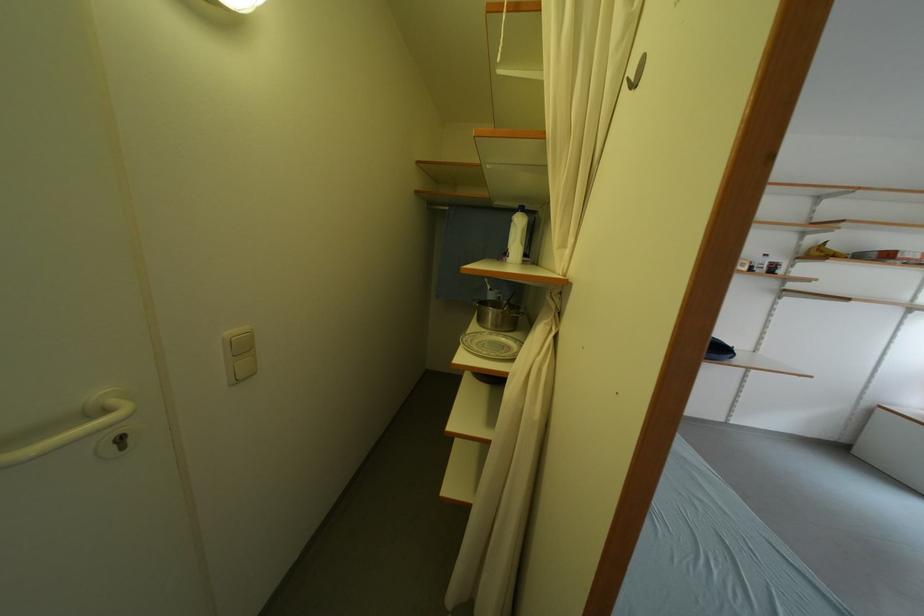
The height and width of the screenshot is (616, 924). Find the location of `white door handle`. white door handle is located at coordinates (56, 440).